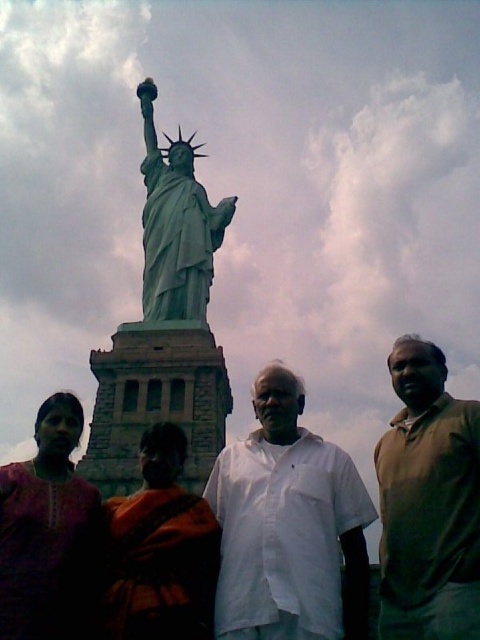
Question: Estimate the real-world distances between objects in this image. Which object is closer to the white cotton shirt at center?

Choices:
 (A) purple fabric at lower left
 (B) brown fabric shirt at center

Answer: (B)

Question: Does purple fabric at lower left have a larger size compared to orange fabric at center?

Choices:
 (A) no
 (B) yes

Answer: (B)

Question: Which point appears farthest from the camera in this image?

Choices:
 (A) (431, 467)
 (B) (144, 92)
 (C) (56, 554)

Answer: (B)

Question: Is the position of white cotton shirt at center less distant than that of brown fabric shirt at center?

Choices:
 (A) yes
 (B) no

Answer: (A)

Question: Is white cotton shirt at center positioned before green patina statue at center?

Choices:
 (A) yes
 (B) no

Answer: (A)

Question: Which object appears farthest from the camera in this image?

Choices:
 (A) white cotton shirt at center
 (B) orange fabric at center
 (C) purple fabric at lower left
 (D) green patina statue at center

Answer: (D)